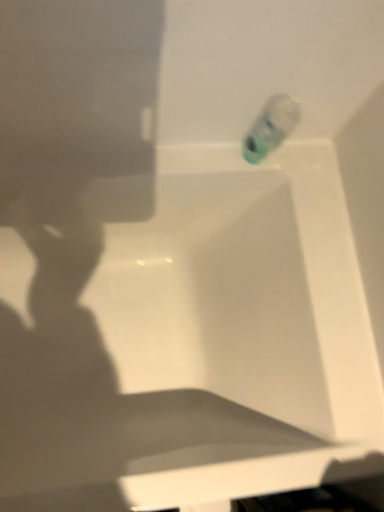
Question: Looking at the image, does white glossy bathtub at upper center seem bigger or smaller compared to translucent plastic bottle at upper right?

Choices:
 (A) big
 (B) small

Answer: (A)

Question: From the image's perspective, is white glossy bathtub at upper center located above or below translucent plastic bottle at upper right?

Choices:
 (A) below
 (B) above

Answer: (A)

Question: Is white glossy bathtub at upper center in front of or behind translucent plastic bottle at upper right in the image?

Choices:
 (A) front
 (B) behind

Answer: (A)

Question: From their relative heights in the image, would you say translucent plastic bottle at upper right is taller or shorter than white glossy bathtub at upper center?

Choices:
 (A) short
 (B) tall

Answer: (A)

Question: Considering the positions of translucent plastic bottle at upper right and white glossy bathtub at upper center in the image, is translucent plastic bottle at upper right bigger or smaller than white glossy bathtub at upper center?

Choices:
 (A) big
 (B) small

Answer: (B)

Question: From a real-world perspective, is translucent plastic bottle at upper right positioned above or below white glossy bathtub at upper center?

Choices:
 (A) above
 (B) below

Answer: (A)

Question: Would you say translucent plastic bottle at upper right is to the left or to the right of white glossy bathtub at upper center in the picture?

Choices:
 (A) right
 (B) left

Answer: (A)